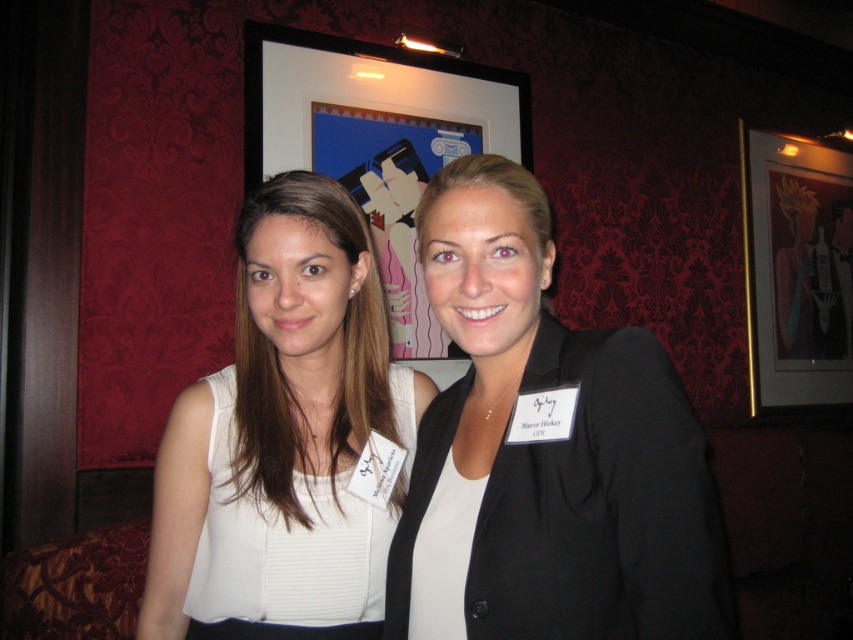
Describe the element at coordinates (283, 438) in the screenshot. I see `white matte dress at center` at that location.

Is white matte dress at center wider than black framed picture at upper center?

In fact, white matte dress at center might be narrower than black framed picture at upper center.

Between point (271, 410) and point (309, 129), which one is positioned behind?

The point (309, 129) is behind.

At what (x,y) coordinates should I click in order to perform the action: click on white matte dress at center. Please return your answer as a coordinate pair (x, y). Looking at the image, I should click on (x=283, y=438).

Which is more to the right, white matte dress at center or matte black frame at upper center?

matte black frame at upper center

Looking at this image, who is shorter, white matte dress at center or matte black frame at upper center?

white matte dress at center is shorter.

Between point (306, 538) and point (769, 152), which one is positioned behind?

Positioned behind is point (769, 152).

Where is `white matte dress at center`? white matte dress at center is located at coordinates (283, 438).

Is the position of black matte blazer at center more distant than that of white matte dress at center?

No.

Where is `black matte blazer at center`? Image resolution: width=853 pixels, height=640 pixels. black matte blazer at center is located at coordinates (546, 452).